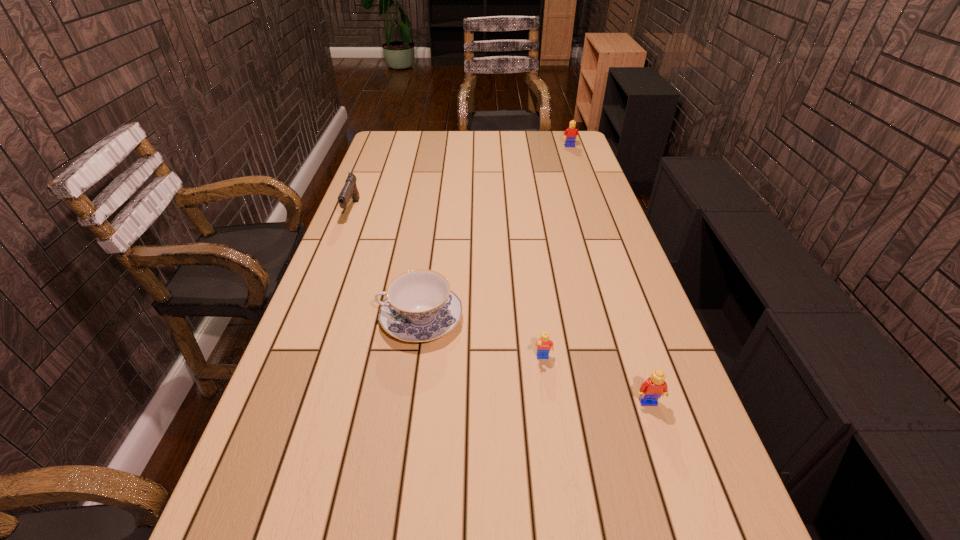
At what (x,y) coordinates should I click in order to perform the action: click on the farthest Lego. Please return your answer as a coordinate pair (x, y). This screenshot has width=960, height=540. Looking at the image, I should click on (571, 133).

What are the coordinates of `gun` in the screenshot? It's located at (350, 190).

Find the location of a particular element. the leftmost object is located at coordinates (350, 190).

This screenshot has width=960, height=540. What are the coordinates of `chinaware` in the screenshot? It's located at (420, 306).

Find the location of a particular element. The image size is (960, 540). the third farthest object is located at coordinates (420, 306).

You are a GUI agent. You are given a task and a screenshot of the screen. Output one action in this format:
    pyautogui.click(x=<x>, y=<y>)
    Task: Click on the nearest object
    The height and width of the screenshot is (540, 960).
    Given the screenshot: What is the action you would take?
    pyautogui.click(x=654, y=387)

Identify the location of the third object from right to left. This screenshot has height=540, width=960. (544, 344).

The width and height of the screenshot is (960, 540). I want to click on the shortest object, so click(544, 344).

Identify the location of vacant space located 0.350m on the face of the farthest Lego. The width and height of the screenshot is (960, 540). (585, 188).

I want to click on vacant point located in the direction the gun is aimed, so click(343, 233).